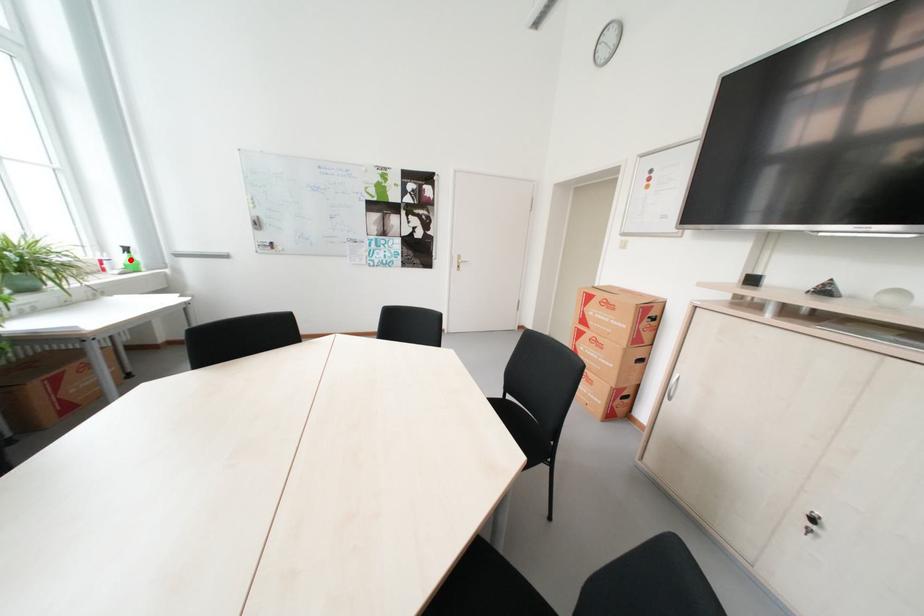
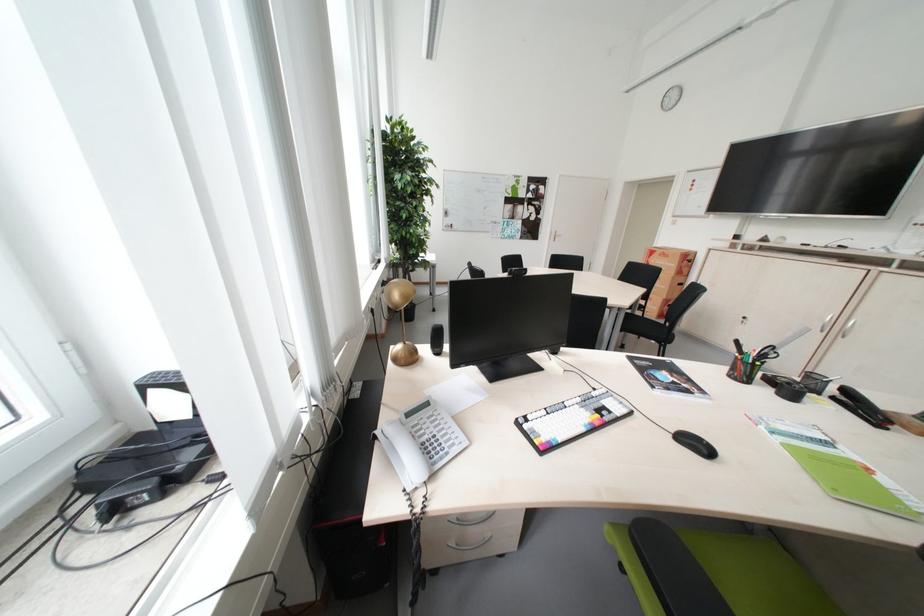
Question: I am providing you with two images of the same scene from different viewpoints. A red point is marked on the first image. Can you still see the location of the red point in image 2?

Choices:
 (A) Yes
 (B) No

Answer: (B)